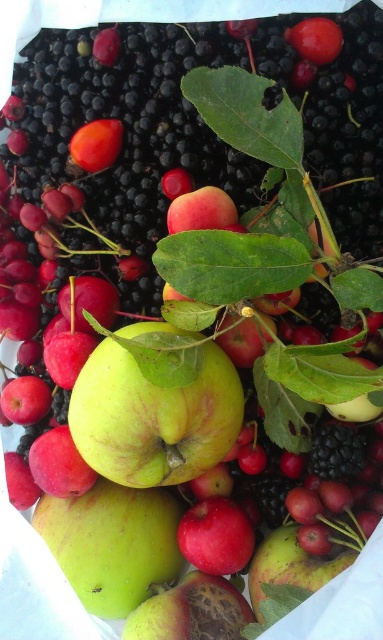
Question: Does green matte apple at center appear over smooth orange fruit at upper left?

Choices:
 (A) no
 (B) yes

Answer: (A)

Question: Can you confirm if green matte apple at center is wider than smooth orange fruit at upper left?

Choices:
 (A) yes
 (B) no

Answer: (A)

Question: Among these points, which one is nearest to the camera?

Choices:
 (A) (180, 461)
 (B) (96, 160)

Answer: (A)

Question: Is green matte apple at center bigger than smooth orange fruit at upper left?

Choices:
 (A) yes
 (B) no

Answer: (A)